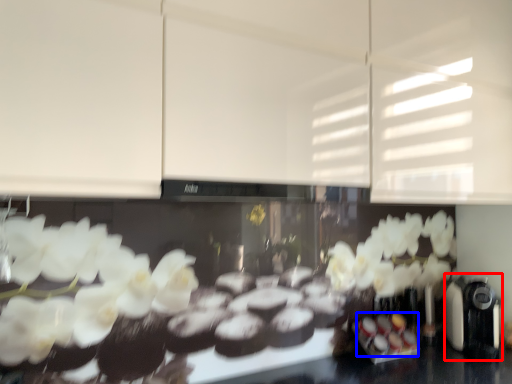
Question: Which object is further to the camera taking this photo, coffee machine (highlighted by a red box) or food (highlighted by a blue box)?

Choices:
 (A) coffee machine
 (B) food

Answer: (B)